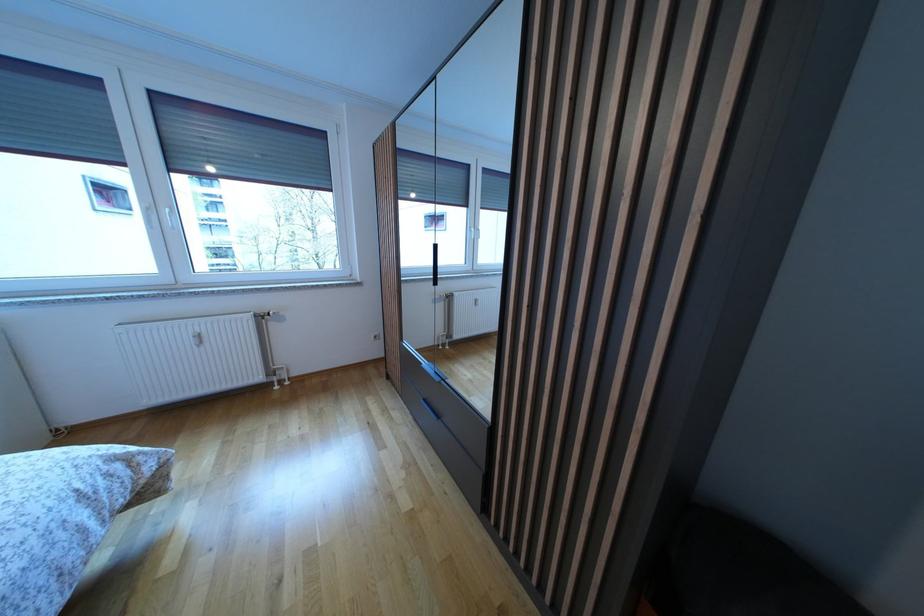
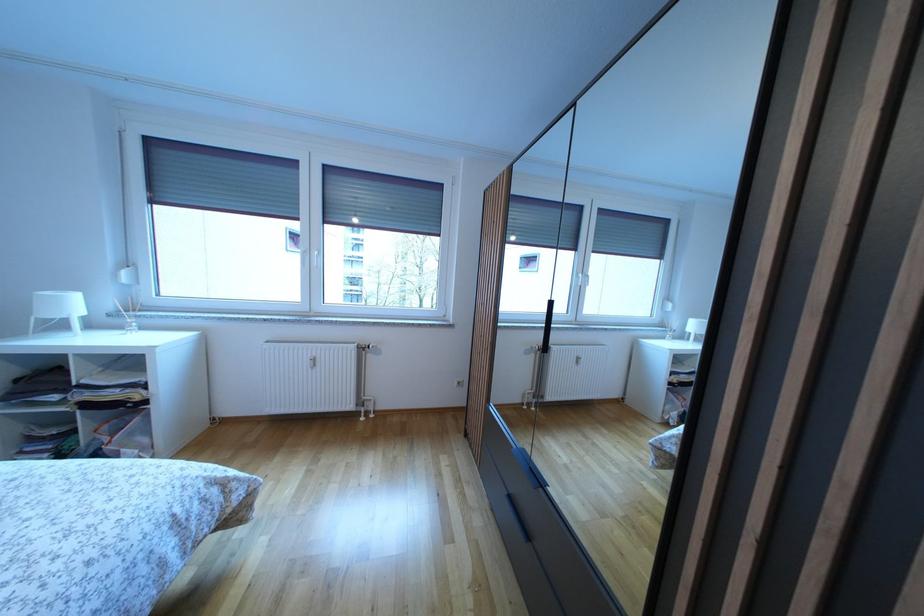
The point at [198,347] is marked in the first image. Where is the corresponding point in the second image?

(314, 370)